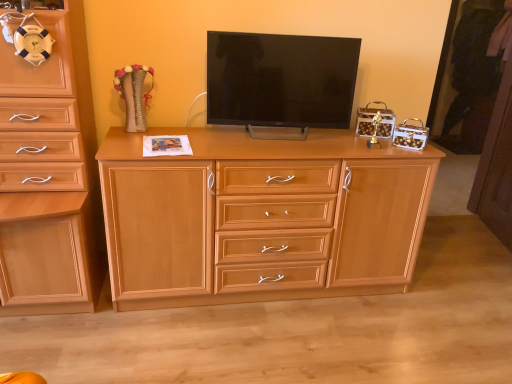
This screenshot has width=512, height=384. What are the coordinates of `free space on the front side of light wood chest of drawers at center, marked as the first chest of drawers in a right-to-left arrangement` in the screenshot? It's located at (260, 344).